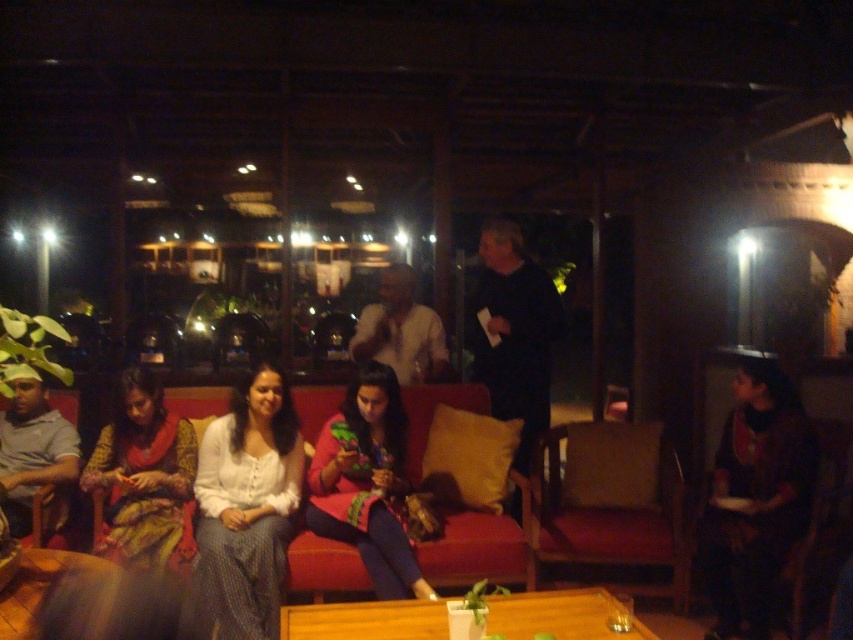
Based on the photo, you are planning to take a photo of the multicolored fabric dress at center and the wooden table at lower left. Which object should you focus on first if you want to capture both in a single frame without moving the camera?

The multicolored fabric dress at center is bigger than the wooden table at lower left, so you should focus on the wooden table at lower left first to ensure both fit in the frame.

Looking at this image, you are organizing a photoshoot and need to ensure that the multicolored fabric dress at center and the wooden table at lower left can fit side by side in a narrow space. Based on the scene description, can you determine if they can be placed next to each other without overlapping?

The multicolored fabric dress at center might be wider than the wooden table at lower left, so there is uncertainty about whether they can fit side by side without overlapping. Further measurement would be needed to confirm.

You are standing in the lounge and want to hand a drink to the person wearing the white textured blouse at center. Based on their position, which direction should you approach from?

The white textured blouse at center is located at point (248,506), which indicates it is positioned towards the right side of the image. Therefore, you should approach from the right side to reach the person comfortably.